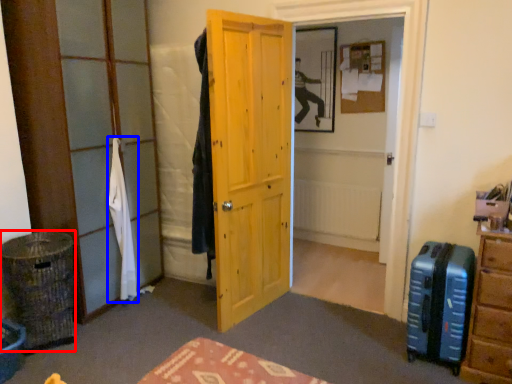
Question: Which point is further to the camera, laundry basket (highlighted by a red box) or clothing (highlighted by a blue box)?

Choices:
 (A) laundry basket
 (B) clothing

Answer: (B)